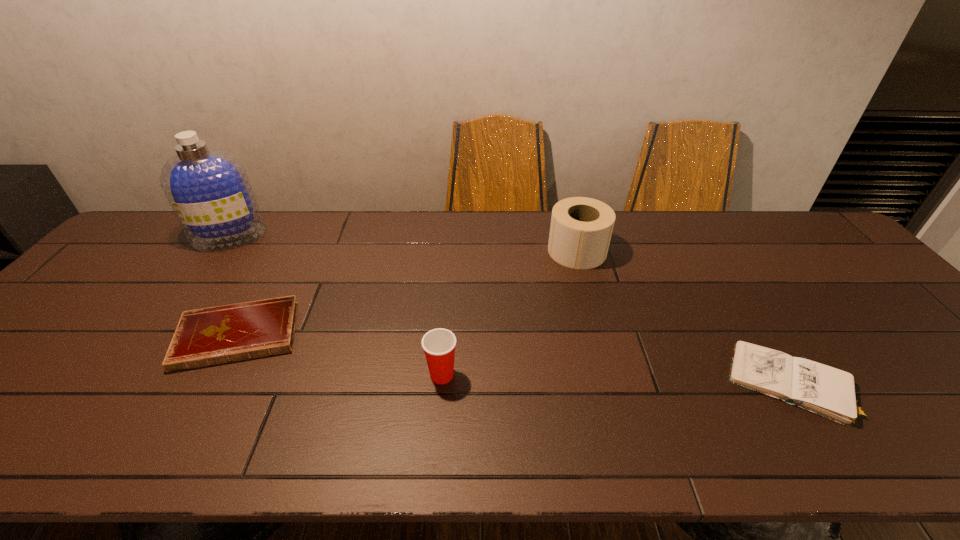
Locate an element on the screen. vacant space located on the left of the left notebook is located at coordinates (140, 335).

Locate an element on the screen. free space located on the back of the right notebook is located at coordinates (749, 320).

This screenshot has width=960, height=540. In order to click on cleansing agent that is at the far edge in this screenshot , I will do `click(208, 189)`.

The height and width of the screenshot is (540, 960). Find the location of `toilet tissue that is at the far edge`. toilet tissue that is at the far edge is located at coordinates (581, 228).

This screenshot has width=960, height=540. Identify the location of object that is at the near edge. (829, 392).

The image size is (960, 540). In the image, there is a desktop. In order to click on vacant space at the far edge in this screenshot , I will do `click(635, 247)`.

You are a GUI agent. You are given a task and a screenshot of the screen. Output one action in this format:
    pyautogui.click(x=<x>, y=<y>)
    Task: Click on the free space at the near edge of the desktop
    
    Given the screenshot: What is the action you would take?
    pyautogui.click(x=93, y=454)

Where is `vacant space at the left edge`? The image size is (960, 540). vacant space at the left edge is located at coordinates [x=99, y=333].

Where is `vacant region at the far left corner of the desktop`? vacant region at the far left corner of the desktop is located at coordinates (135, 234).

This screenshot has height=540, width=960. Find the location of `free space between the right notebook and the tallest object`. free space between the right notebook and the tallest object is located at coordinates (510, 309).